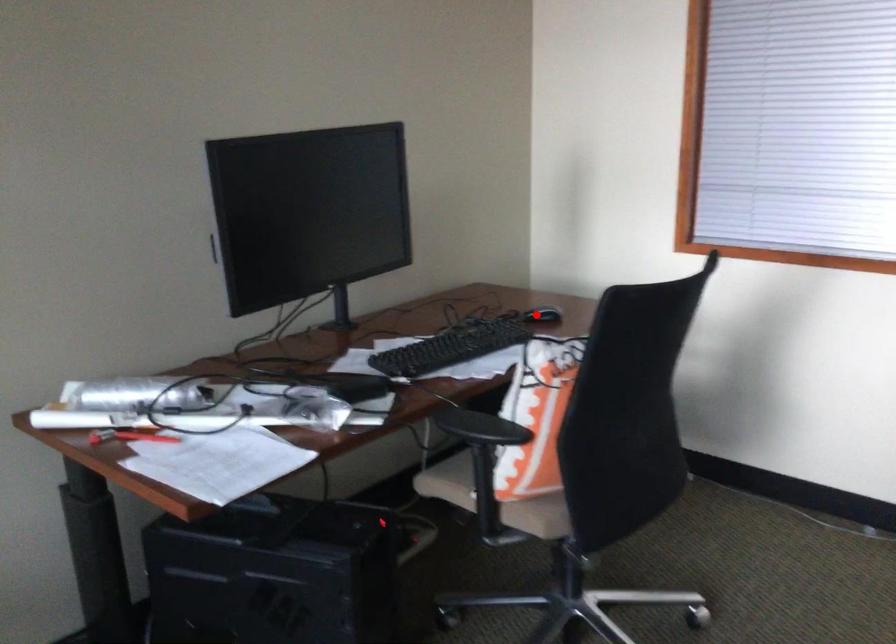
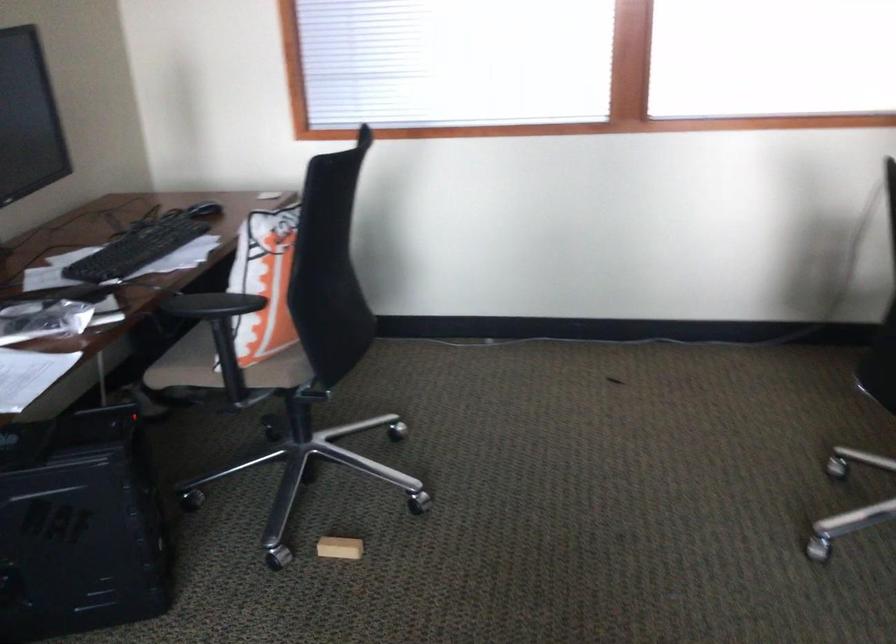
Find the pixel in the second image that matches the highlighted location in the first image.

(204, 210)